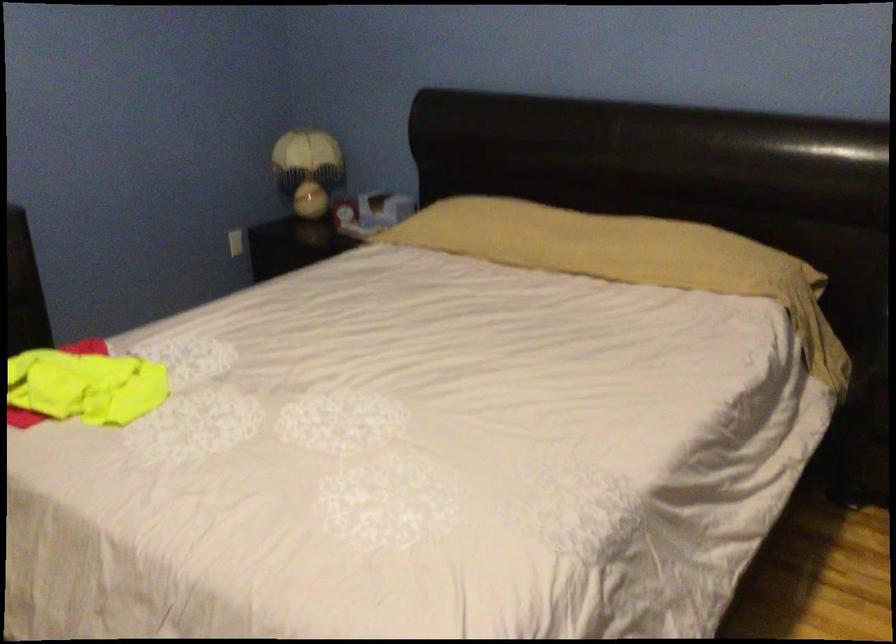
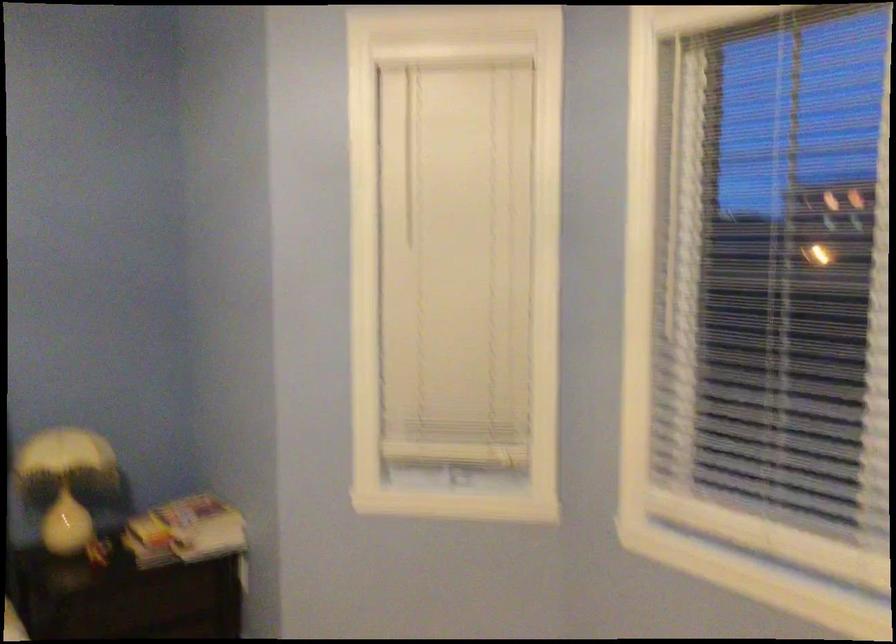
Question: The camera is either moving clockwise (left) or counter-clockwise (right) around the object. The first image is from the beginning of the video and the second image is from the end. Is the camera moving left or right when shooting the video?

Choices:
 (A) Left
 (B) Right

Answer: (A)